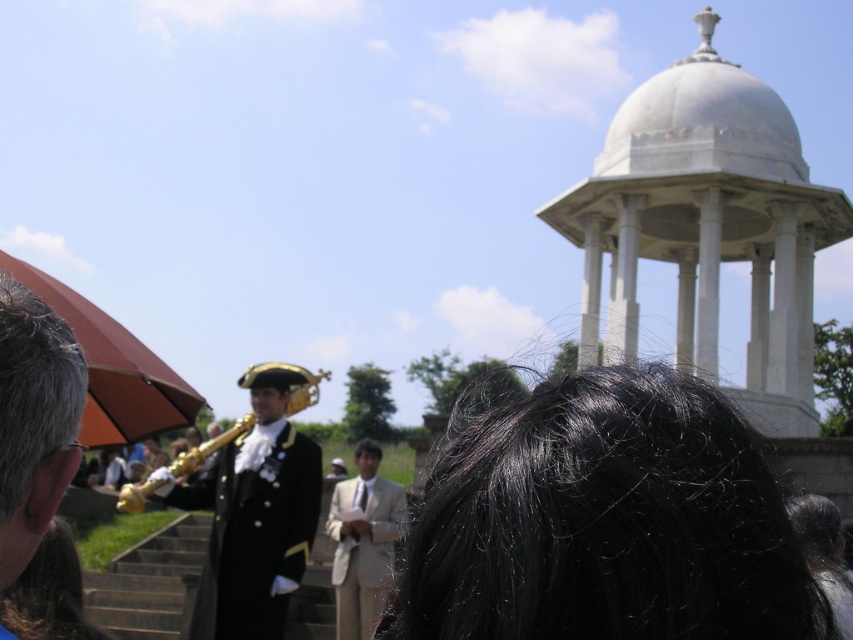
You are attending an event at the white marble gazebo at upper right and need to reach the beige fabric suit at center to greet them. Which direction should you move relative to your current position?

The white marble gazebo at upper right is located above the beige fabric suit at center, so you should move downward to reach them.

You are standing at the center of the image and want to locate the white marble gazebo at upper right. According to the coordinates provided, in which direction should you look to see it?

The white marble gazebo at upper right is located at coordinates (706, 227). Since you are at the center, looking towards the upper right direction will allow you to see it.